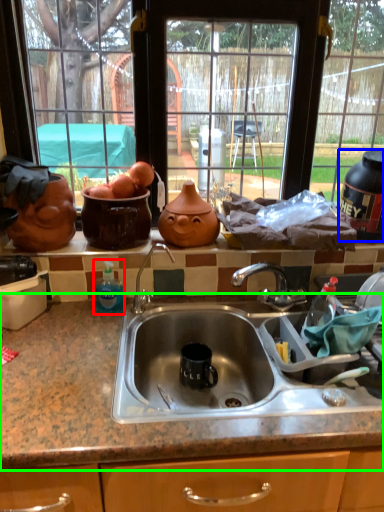
Question: Considering the real-world distances, which object is farthest from bottle (highlighted by a red box)? appliance (highlighted by a blue box) or countertop (highlighted by a green box)?

Choices:
 (A) appliance
 (B) countertop

Answer: (A)